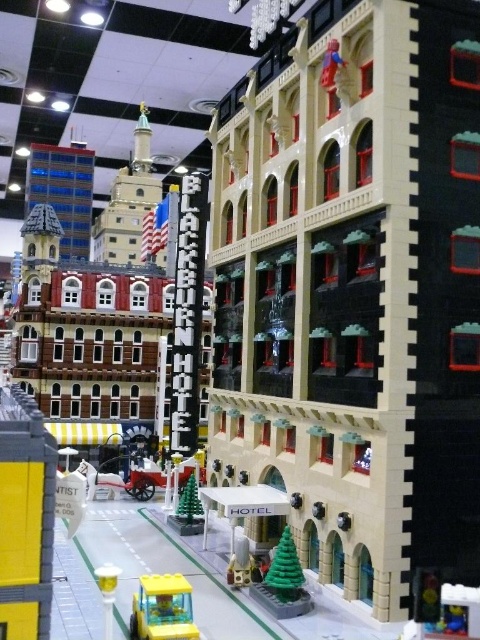
From the picture: You are standing in the Lego cityscape and notice both the green matte Christmas tree at center and the matte gray statue at center. From your vantage point, which object appears higher up in the scene?

The matte gray statue at center appears higher up because the green matte Christmas tree at center is located below it.

You are a delivery person in the Lego city and need to deliver a package to the Blackburn Hotel. You have a drone that can carry packages up to 3 meters. The drone can only fly straight from your current position at the translucent yellow plastic car at lower left to the matte gray statue at center. Can the drone reach the statue without exceeding its maximum flight distance?

The distance between the translucent yellow plastic car at lower left and the matte gray statue at center is 3.34 meters, which exceeds the drone maximum flight distance of 3 meters. Therefore, the drone cannot reach the statue without exceeding its limit.